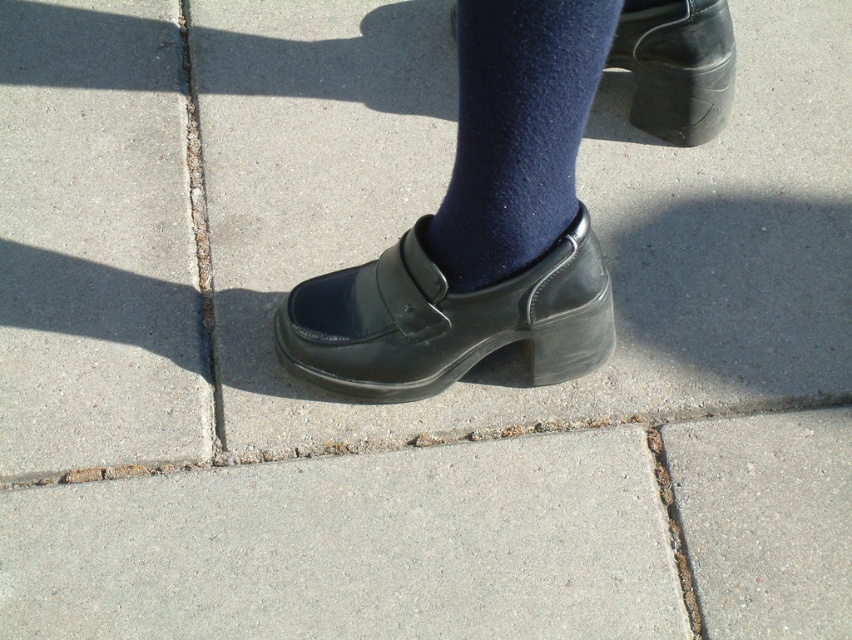
Is point (327, 326) positioned in front of point (640, 116)?

Yes, it is.

Between black leather shoe at center and black leather shoe at upper right, which one is positioned higher?

black leather shoe at upper right

The image size is (852, 640). What do you see at coordinates (446, 320) in the screenshot? I see `black leather shoe at center` at bounding box center [446, 320].

In order to click on black leather shoe at center in this screenshot , I will do `click(446, 320)`.

Who is shorter, navy woolen sock at center or black leather shoe at upper right?

With less height is black leather shoe at upper right.

Between navy woolen sock at center and black leather shoe at upper right, which one is positioned lower?

navy woolen sock at center

Which is behind, point (499, 234) or point (701, 134)?

The point (701, 134) is more distant.

At what (x,y) coordinates should I click in order to perform the action: click on navy woolen sock at center. Please return your answer as a coordinate pair (x, y). This screenshot has width=852, height=640. Looking at the image, I should click on (516, 132).

Between black leather shoe at center and navy woolen sock at center, which one has more height?

navy woolen sock at center is taller.

Is black leather shoe at center positioned behind navy woolen sock at center?

Yes.

What do you see at coordinates (446, 320) in the screenshot? I see `black leather shoe at center` at bounding box center [446, 320].

Locate an element on the screen. The height and width of the screenshot is (640, 852). black leather shoe at center is located at coordinates (446, 320).